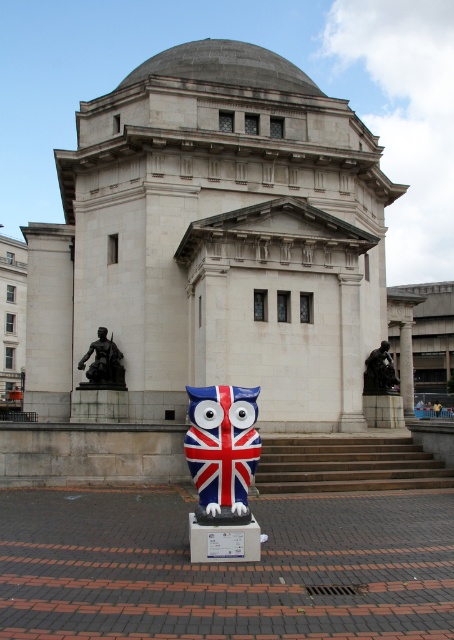
Which is below, black polished statue at left or bronze statue at center?

bronze statue at center is below.

Locate an element on the screen. The height and width of the screenshot is (640, 454). black polished statue at left is located at coordinates (103, 364).

Who is more distant from viewer, (x=110, y=388) or (x=375, y=369)?

The point (x=375, y=369) is behind.

You are a GUI agent. You are given a task and a screenshot of the screen. Output one action in this format:
    pyautogui.click(x=<x>, y=<y>)
    Task: Click on the black polished statue at left
    The height and width of the screenshot is (640, 454).
    Given the screenshot: What is the action you would take?
    pyautogui.click(x=103, y=364)

Is point (188, 460) positioned in front of point (411, 353)?

Yes, point (188, 460) is in front of point (411, 353).

Is union jack painted owl at center behind smooth stone statue at right?

No.

Is point (197, 476) behind point (405, 404)?

That is False.

Identify the location of union jack painted owl at center. (222, 445).

Looking at this image, is bronze statue at center shorter than smooth stone statue at right?

Yes.

Describe the element at coordinates (379, 371) in the screenshot. I see `bronze statue at center` at that location.

Who is more distant from viewer, (375, 384) or (413, 401)?

The point (413, 401) is more distant.

Find the location of a particular element. This screenshot has width=454, height=640. bronze statue at center is located at coordinates (379, 371).